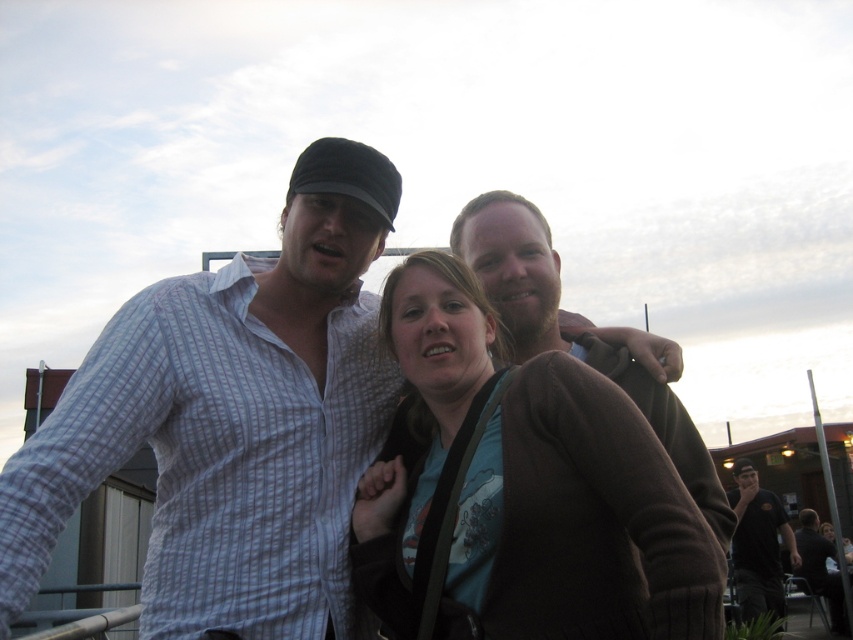
You are a fashion designer observing the clothing items in the scene. Which clothing item, the brown soft sweater at center or the black cotton shirt at lower right, appears shorter in height?

The brown soft sweater at center has a lesser height compared to the black cotton shirt at lower right, so the brown soft sweater at center appears shorter in height.

You are a photographer standing at the edge of the scene. You want to take a photo that includes both the brown soft sweater at center and the black cotton shirt at lower right. Given that your camera has a maximum zoom range of 10 meters, will you be able to capture both subjects in the same frame without moving closer?

The brown soft sweater at center and the black cotton shirt at lower right are 10.71 meters apart from each other. Since the camera can only zoom up to 10 meters, the distance between them exceeds the maximum zoom range. Therefore, you cannot capture both subjects in the same frame without moving closer.

You are trying to locate the brown soft sweater at center in the image. According to the scene description, where exactly is it positioned?

The brown soft sweater at center is located at the coordinates point (527, 490).